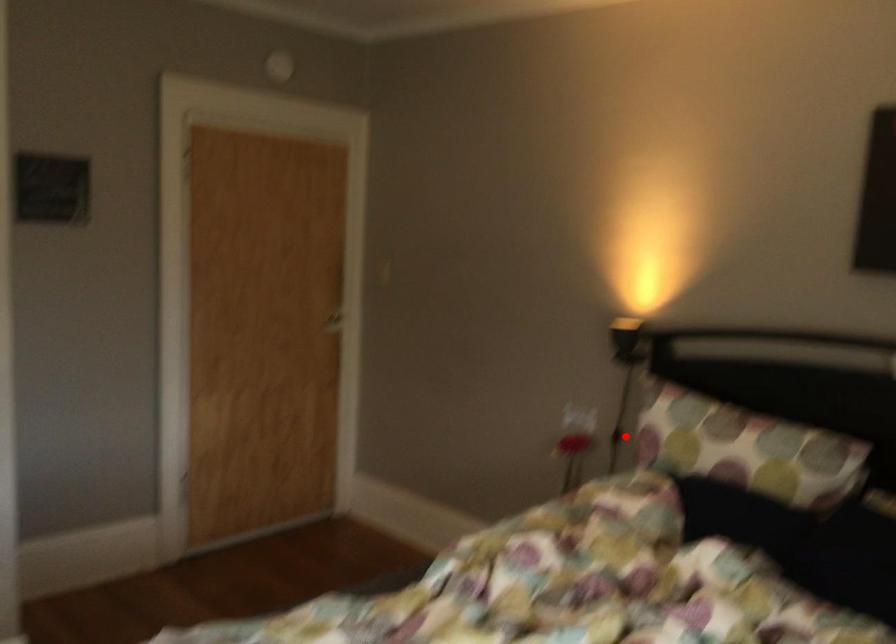
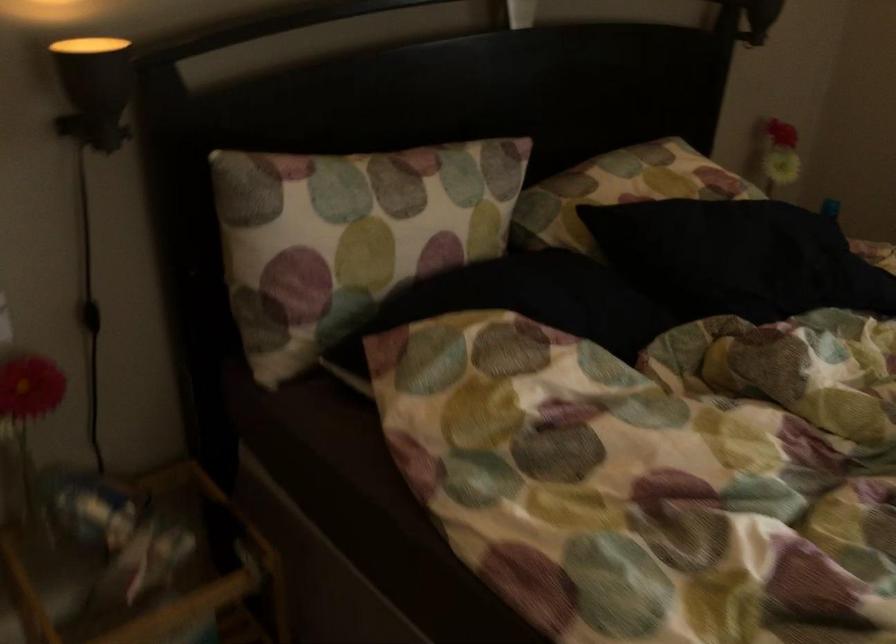
Question: I am providing you with two images of the same scene from different viewpoints. Given a red point in image1, look at the same physical point in image2. Is it:

Choices:
 (A) Closer to the viewpoint
 (B) Farther from the viewpoint

Answer: (A)